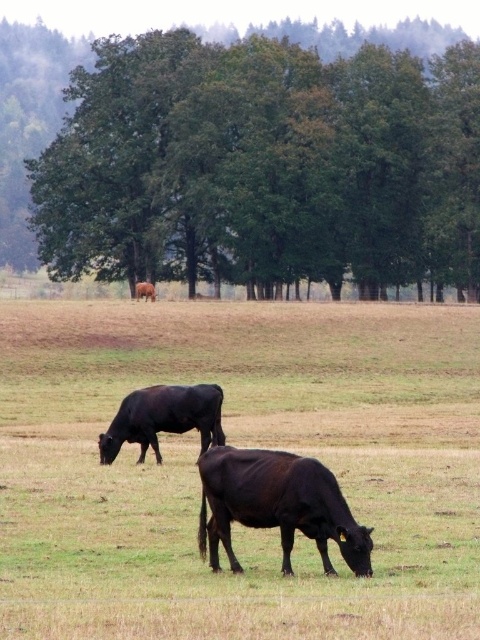
Question: Which point is farther to the camera?

Choices:
 (A) shiny black bull at lower center
 (B) shiny dark brown bull at lower center
 (C) brown smooth cow at center

Answer: (A)

Question: Can you confirm if brown smooth cow at center is wider than shiny black bull at lower center?

Choices:
 (A) no
 (B) yes

Answer: (B)

Question: Which of these objects is positioned farthest from the brown smooth cow at center?

Choices:
 (A) shiny black bull at lower center
 (B) brown matte cow at center
 (C) green leafy tree at center
 (D) shiny dark brown bull at lower center

Answer: (C)

Question: From the image, what is the correct spatial relationship of green leafy tree at center in relation to shiny dark brown bull at lower center?

Choices:
 (A) right
 (B) left

Answer: (B)

Question: Is shiny dark brown bull at lower center smaller than shiny black bull at lower center?

Choices:
 (A) yes
 (B) no

Answer: (A)

Question: Among these objects, which one is nearest to the camera?

Choices:
 (A) brown smooth cow at center
 (B) green leafy tree at center

Answer: (A)